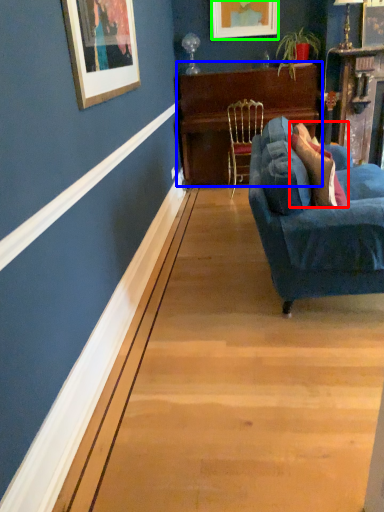
Question: Estimate the real-world distances between objects in this image. Which object is farther from pillow (highlighted by a red box), table (highlighted by a blue box) or picture frame (highlighted by a green box)?

Choices:
 (A) table
 (B) picture frame

Answer: (B)